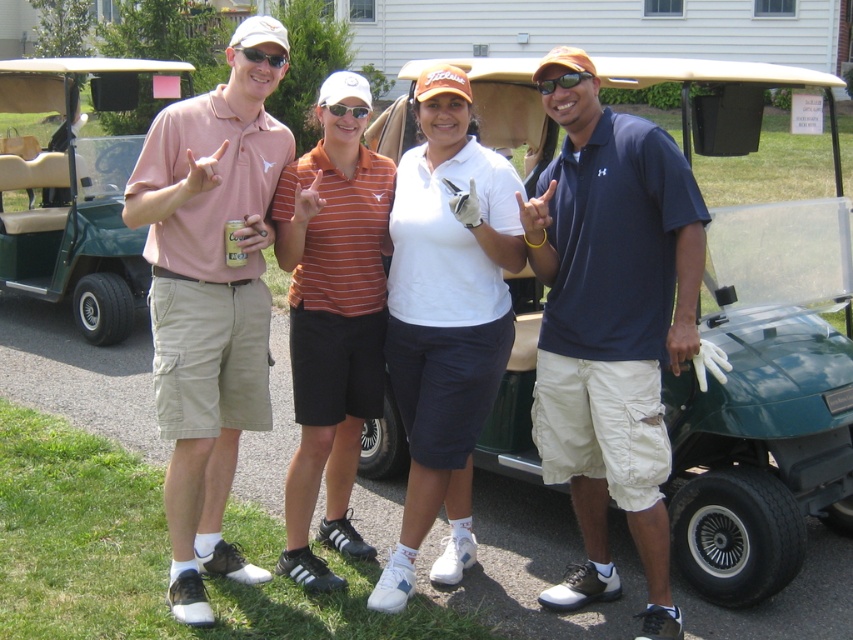
Is point (410, 572) more distant than point (346, 369)?

No, (410, 572) is in front of (346, 369).

Can you confirm if white matte golf glove at center is thinner than orange striped polo shirt at center?

Incorrect, white matte golf glove at center's width is not less than orange striped polo shirt at center's.

Between point (407, 301) and point (294, 200), which one is positioned behind?

Positioned behind is point (407, 301).

Where is `white matte golf glove at center`? The height and width of the screenshot is (640, 853). white matte golf glove at center is located at coordinates pos(445,317).

Can you confirm if green matte golf cart at center is positioned to the right of white plastic goggles at center?

Correct, you'll find green matte golf cart at center to the right of white plastic goggles at center.

Does point (503, 77) lie behind point (345, 112)?

Yes, it is.

Which is in front, point (689, 77) or point (352, 106)?

Point (352, 106) is more forward.

Locate an element on the screen. This screenshot has height=640, width=853. green matte golf cart at center is located at coordinates (758, 349).

I want to click on green matte golf cart at center, so click(758, 349).

Can you confirm if green matte golf cart at center is positioned above matte black sunglasses at upper center?

No.

Between point (780, 540) and point (281, 60), which one is positioned in front?

Positioned in front is point (281, 60).

At what (x,y) coordinates should I click in order to perform the action: click on green matte golf cart at center. Please return your answer as a coordinate pair (x, y). The width and height of the screenshot is (853, 640). Looking at the image, I should click on (758, 349).